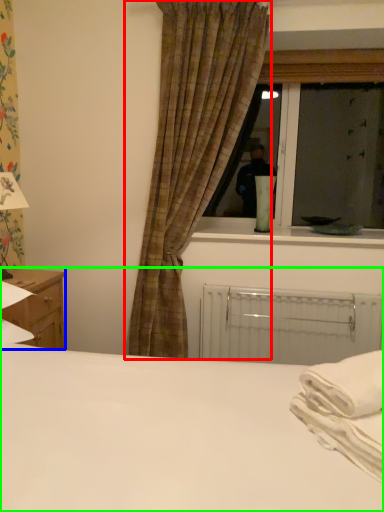
Question: Based on their relative distances, which object is farther from curtain (highlighted by a red box)? Choose from nightstand (highlighted by a blue box) and bed (highlighted by a green box).

Choices:
 (A) nightstand
 (B) bed

Answer: (B)